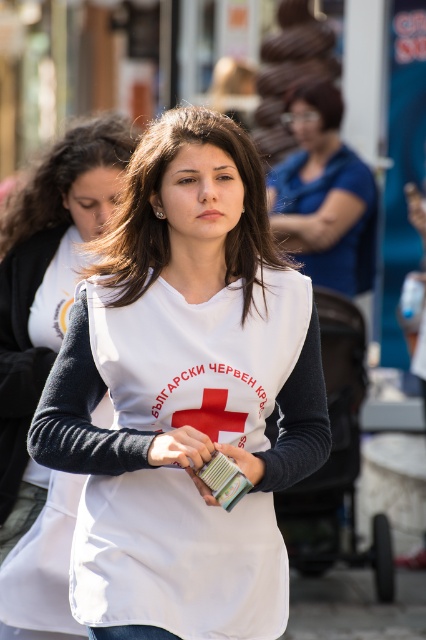
You are standing at the origin point in the image. Which of the two points, point (236, 211) or point (11, 364), is closer to you?

Point (236, 211) is in front of point (11, 364), so it is closer to you.

You are standing in the public area shown in the image and want to walk from point (x=216, y=189) to point (x=127, y=632). Which direction should you move to get closer to your destination?

You should move towards the camera because point (x=216, y=189) is further away from the camera than point (x=127, y=632). Moving towards the camera will bring you closer to your destination.